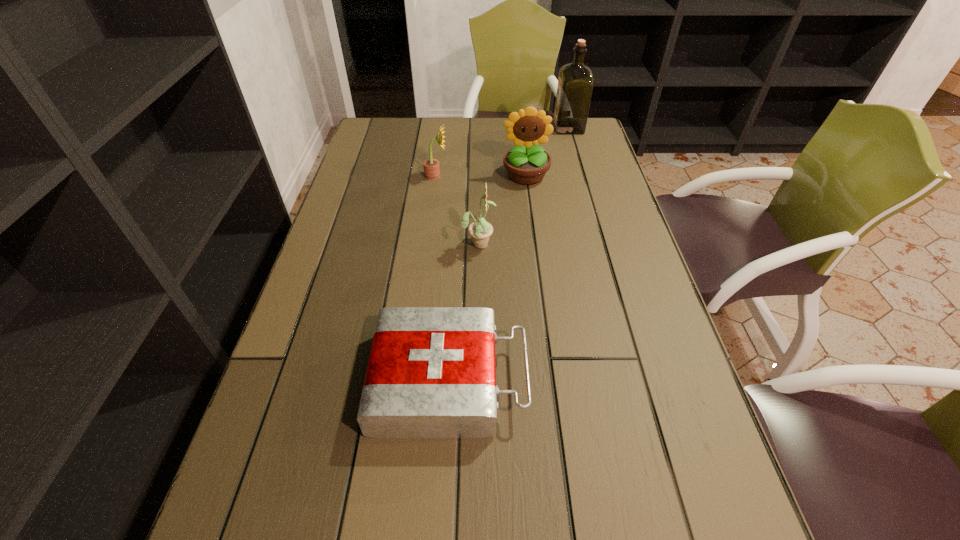
This screenshot has width=960, height=540. Find the location of `sunflower object that ranks as the closest to the leftmost sunflower`. sunflower object that ranks as the closest to the leftmost sunflower is located at coordinates (527, 163).

This screenshot has width=960, height=540. I want to click on free spot that satisfies the following two spatial constraints: 1. on the label of the rightmost object; 2. on the face of the fourth shortest object, so click(x=583, y=175).

You are a GUI agent. You are given a task and a screenshot of the screen. Output one action in this format:
    pyautogui.click(x=<x>, y=<y>)
    Task: Click on the vacant space that satisfies the following two spatial constraints: 1. on the face of the fourth shortest object; 2. on the front-facing side of the nearest sunflower
    The width and height of the screenshot is (960, 540).
    Given the screenshot: What is the action you would take?
    pyautogui.click(x=534, y=243)

The width and height of the screenshot is (960, 540). Identify the location of vacant space that satisfies the following two spatial constraints: 1. on the face of the rightmost sunflower; 2. on the front-facing side of the second sunflower from left to right. (534, 243).